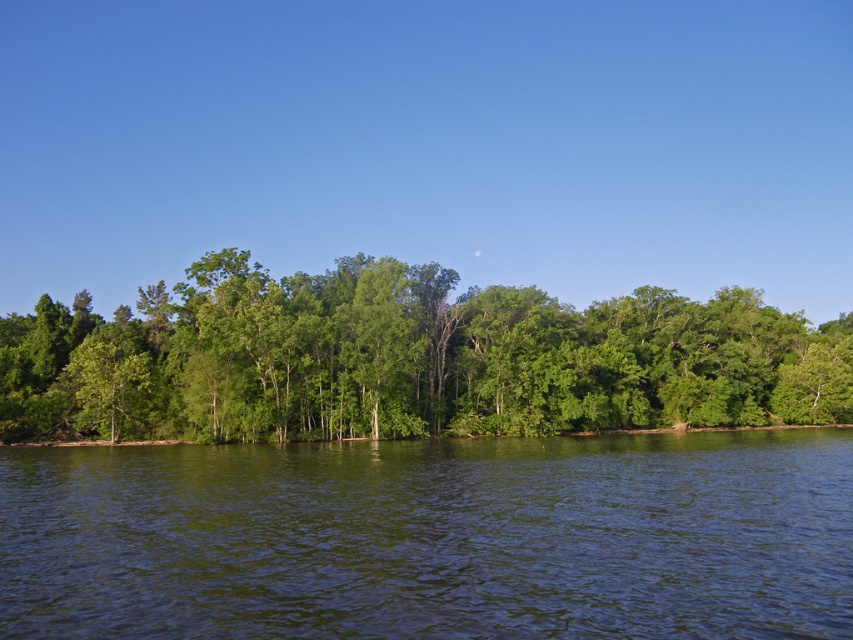
Consider the image. You are standing at the edge of the scene and want to step onto the green reflective water at center. Based on its position, is it possible to reach it directly from your current position?

The green reflective water at center is located at point (x=432, y=538), which is likely in the middle of the water area. Since you are at the edge, you can walk towards the coordinates to reach it directly.